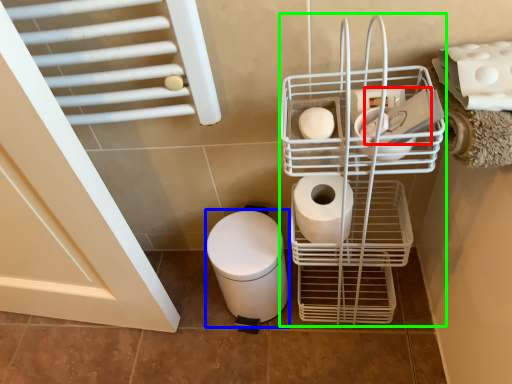
Question: Which object is the closest to the toilet paper (highlighted by a red box)? Choose among these: toilet bowl (highlighted by a blue box) or shopping cart (highlighted by a green box).

Choices:
 (A) toilet bowl
 (B) shopping cart

Answer: (B)